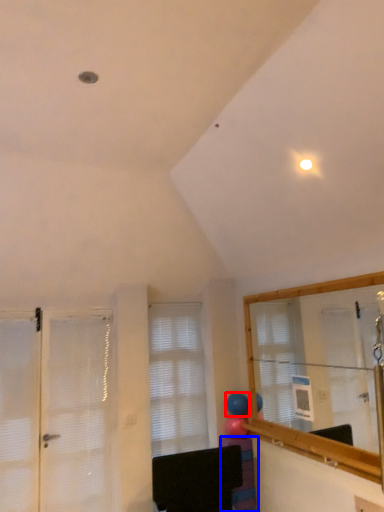
Question: Which object appears farthest to the camera in this image, balloon (highlighted by a red box) or furniture (highlighted by a blue box)?

Choices:
 (A) balloon
 (B) furniture

Answer: (A)